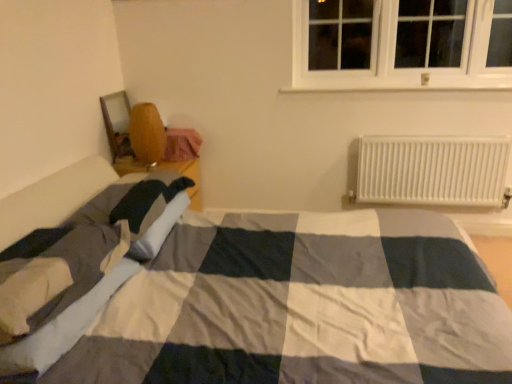
You are a GUI agent. You are given a task and a screenshot of the screen. Output one action in this format:
    pyautogui.click(x=<x>, y=<y>)
    Task: Click on the wooden chair at left
    
    Given the screenshot: What is the action you would take?
    pyautogui.click(x=182, y=144)

Considering the relative positions of wooden chair at left and white cotton blanket at lower left in the image provided, is wooden chair at left to the left of white cotton blanket at lower left from the viewer's perspective?

Incorrect, wooden chair at left is not on the left side of white cotton blanket at lower left.

Is the depth of wooden chair at left greater than that of white cotton blanket at lower left?

That is True.

Who is bigger, wooden chair at left or white cotton blanket at lower left?

white cotton blanket at lower left is bigger.

From the image's perspective, does white plastic radiator at right appear lower than wooden chair at left?

Yes, from the image's perspective, white plastic radiator at right is beneath wooden chair at left.

At what (x,y) coordinates should I click in order to perform the action: click on material located above the white plastic radiator at right (from a real-world perspective). Please return your answer as a coordinate pair (x, y). Looking at the image, I should click on (182, 144).

From a real-world perspective, is white plastic radiator at right over wooden chair at left?

No, from a real-world perspective, white plastic radiator at right is not above wooden chair at left.

Does white cotton blanket at lower left turn towards white plastic radiator at right?

No, white cotton blanket at lower left is not facing towards white plastic radiator at right.

Consider the image. Which of these two, white cotton blanket at lower left or white plastic radiator at right, is smaller?

white plastic radiator at right.

What's the angular difference between white cotton blanket at lower left and white plastic radiator at right's facing directions?

The angular difference between white cotton blanket at lower left and white plastic radiator at right is 90 degrees.

Which object is positioned more to the right, white cotton blanket at lower left or wooden chair at left?

From the viewer's perspective, wooden chair at left appears more on the right side.

The image size is (512, 384). In order to click on material above the white cotton blanket at lower left (from the image's perspective) in this screenshot , I will do `click(182, 144)`.

Does white cotton blanket at lower left lie behind wooden chair at left?

No, the depth of white cotton blanket at lower left is less than that of wooden chair at left.

Based on their sizes in the image, would you say wooden chair at left is bigger or smaller than white plastic radiator at right?

Clearly, wooden chair at left is smaller in size than white plastic radiator at right.

Can you confirm if wooden chair at left is positioned to the left of white plastic radiator at right?

Correct, you'll find wooden chair at left to the left of white plastic radiator at right.

Is wooden chair at left facing towards white plastic radiator at right?

Yes, wooden chair at left is turned towards white plastic radiator at right.

Who is shorter, white plastic radiator at right or white cotton blanket at lower left?

white cotton blanket at lower left.

Find the location of a particular element. The image size is (512, 384). radiator located on the right of white cotton blanket at lower left is located at coordinates (432, 170).

Which object is positioned more to the right, white plastic radiator at right or white cotton blanket at lower left?

white plastic radiator at right is more to the right.

There is a white cotton blanket at lower left. Identify the location of material above it (from a real-world perspective). (182, 144).

The width and height of the screenshot is (512, 384). Identify the location of radiator lying in front of the wooden chair at left. (432, 170).

Considering their positions, is wooden chair at left positioned closer to white plastic radiator at right than white cotton blanket at lower left?

The object closer to white plastic radiator at right is wooden chair at left.

From the image, which object appears to be nearer to white cotton blanket at lower left, wooden chair at left or white plastic radiator at right?

The object closer to white cotton blanket at lower left is wooden chair at left.

When comparing their distances from white cotton blanket at lower left, does white plastic radiator at right or wooden chair at left seem further?

The object further to white cotton blanket at lower left is white plastic radiator at right.

Which object lies nearer to the anchor point wooden chair at left, white plastic radiator at right or white cotton blanket at lower left?

Based on the image, white cotton blanket at lower left appears to be nearer to wooden chair at left.

Considering their positions, is white cotton blanket at lower left positioned further to wooden chair at left than white plastic radiator at right?

The object further to wooden chair at left is white plastic radiator at right.

Estimate the real-world distances between objects in this image. Which object is further from white plastic radiator at right, white cotton blanket at lower left or wooden chair at left?

white cotton blanket at lower left is positioned further to the anchor white plastic radiator at right.

At what (x,y) coordinates should I click in order to perform the action: click on material located between white cotton blanket at lower left and white plastic radiator at right in the left-right direction. Please return your answer as a coordinate pair (x, y). The height and width of the screenshot is (384, 512). Looking at the image, I should click on (182, 144).